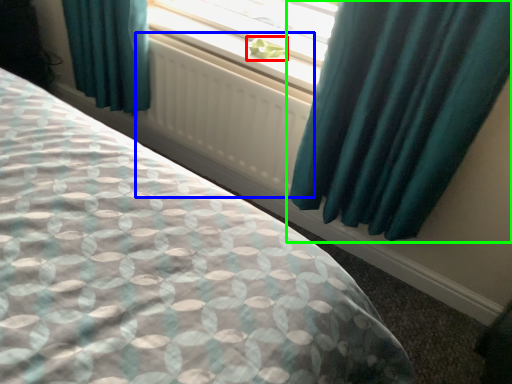
Question: Considering the real-world distances, which object is farthest from plant (highlighted by a red box)? radiator (highlighted by a blue box) or curtain (highlighted by a green box)?

Choices:
 (A) radiator
 (B) curtain

Answer: (B)